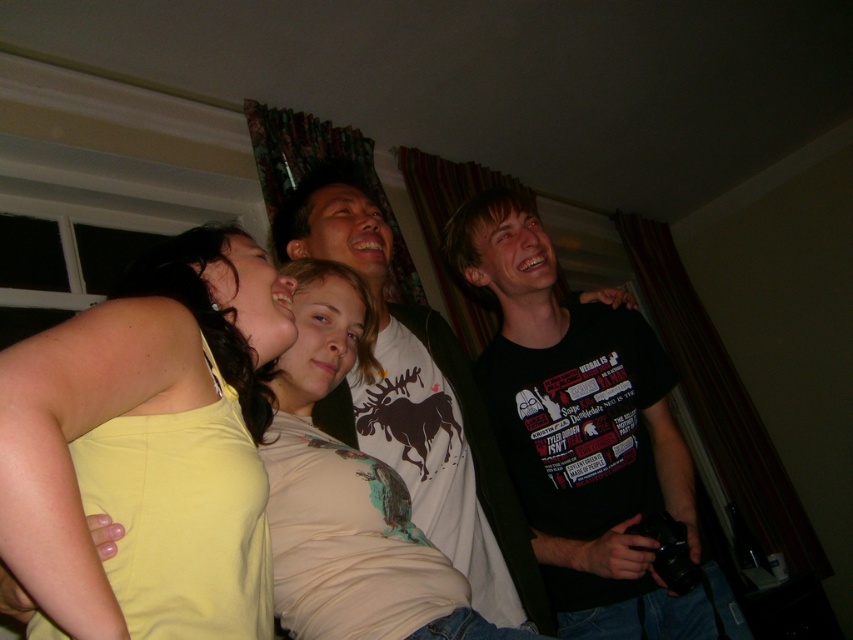
You are standing in the same room as the group and want to take a photo. If you focus your camera on the point at coordinates point (274, 353), will the point at coordinates point (334, 244) also be in focus? Please explain using their positions relative to the camera.

Since point (274, 353) is closer to the camera than point (334, 244), focusing on the closer point may result in the farther point being out of focus depending on the camera aperture. To ensure both are in focus, adjust the aperture for a deeper depth of field.

You are standing in the room and notice the yellow fabric at left. Where exactly is it positioned in terms of coordinates?

The yellow fabric at left is positioned at coordinates point (126, 396).